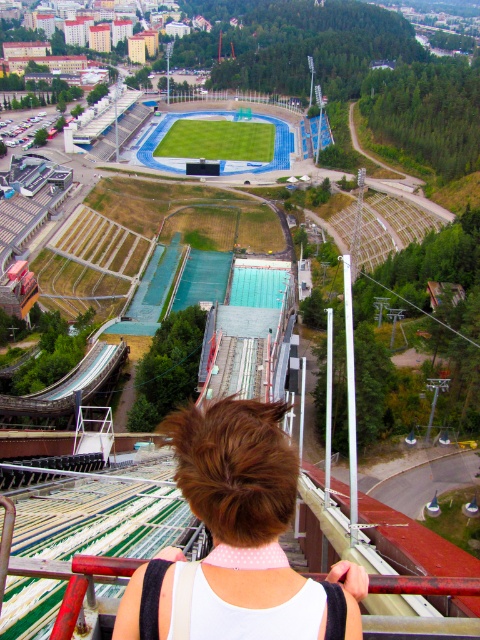
From the picture: You are standing at the edge of the sports complex and see the brown hair at center and the green grass football field at center. Which object is positioned to the right side?

The brown hair at center is to the right of the green grass football field at center, so the brown hair at center is positioned to the right side.

Based on the photo, you are standing at the edge of the sports complex and want to walk to the green grass football field at center. If you start from where the brown hair at center is located, how far will you have to walk in meters?

The brown hair at center is 263.47 meters away from the green grass football field at center, so you will have to walk 263.47 meters to reach it.

Consider the image. You are a photographer trying to capture a wide shot of the sports complex. You notice the brown hair at center and the green grass football field at center in your frame. Which object takes up more space horizontally in the image?

The green grass football field at center takes up more horizontal space since it has a greater width than the brown hair at center.